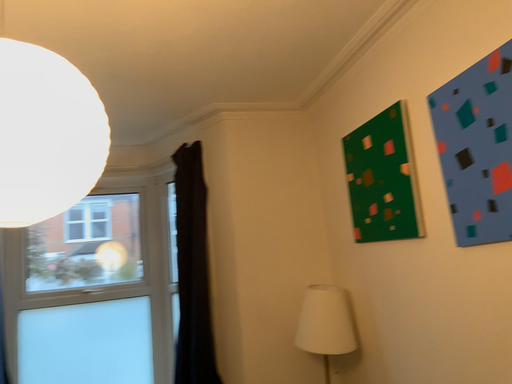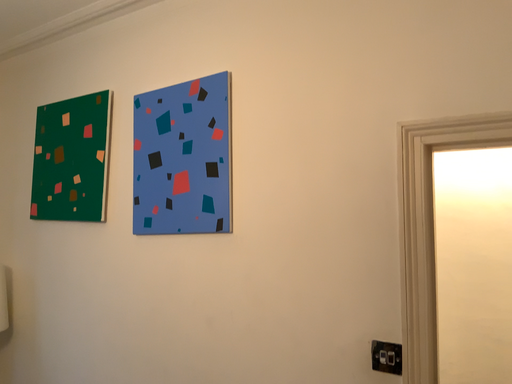
Question: How did the camera likely rotate when shooting the video?

Choices:
 (A) rotated downward
 (B) rotated upward

Answer: (A)